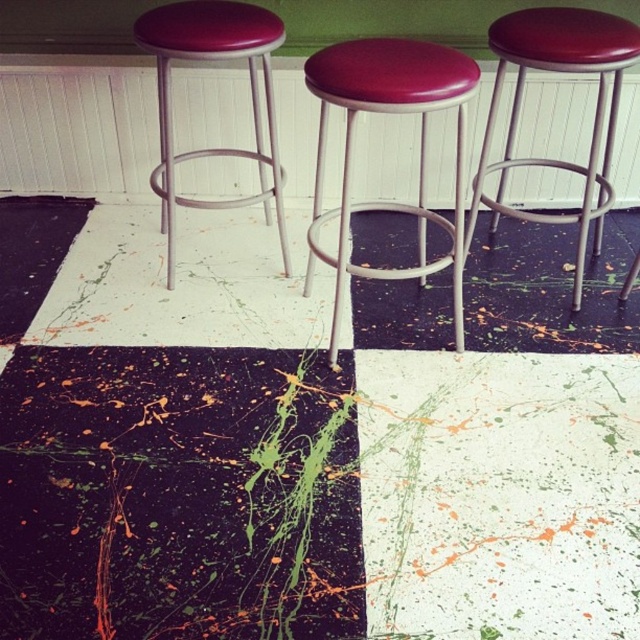
Question: In this image, where is matte red stool at center located relative to matte red stool at right?

Choices:
 (A) above
 (B) below

Answer: (B)

Question: Which point appears farthest from the camera in this image?

Choices:
 (A) (492, 124)
 (B) (288, 252)

Answer: (B)

Question: Can you confirm if matte red stool at center is positioned to the left of matte red stool at right?

Choices:
 (A) yes
 (B) no

Answer: (A)

Question: Which object is the closest to the matte vinyl stool at left?

Choices:
 (A) matte red stool at right
 (B) matte red stool at center

Answer: (B)

Question: Is matte red stool at right in front of matte vinyl stool at left?

Choices:
 (A) yes
 (B) no

Answer: (A)

Question: Among these points, which one is farthest from the camera?

Choices:
 (A) (518, 58)
 (B) (166, 280)

Answer: (B)